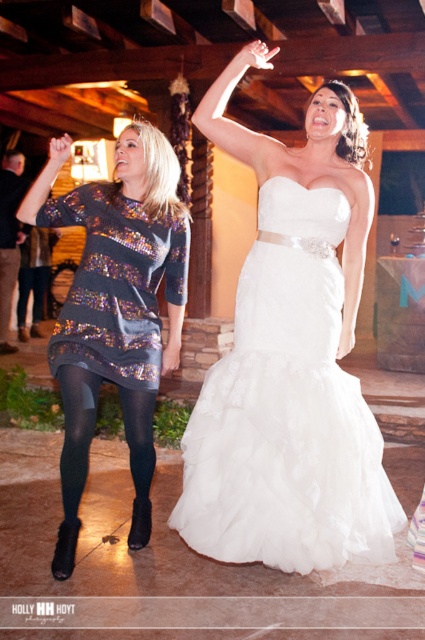
You are a photographer at the wedding reception and need to position yourself to capture the white satin dress at center. Based on the scene description, where should you aim your camera to ensure the dress is in the frame?

A: The white satin dress at center is located at point (289, 364), so you should aim your camera towards those coordinates to ensure the dress is centered in the frame.

You are a photographer at the wedding reception and need to capture a closeup shot of the white satin dress at center and the black tights at lower left. Given the camera lens you have can only focus on objects within a 1.5 meter width, will both items fit in the frame?

The white satin dress at center has a larger width than the black tights at lower left. Since the dress is wider, it might exceed the 1.5 meter width capacity of the camera lens, so both items may not fit in the frame.

Based on the photo, you are a photographer at the wedding reception and want to capture a closeup of the white satin dress at center without the sparkly sequin dress at left appearing in the background. Is this possible given their positions?

The white satin dress at center is closer to the viewer than the sparkly sequin dress at left, so by focusing on the white satin dress at center and using a shallow depth of field, the photographer can blur the background and exclude the sparkly sequin dress at left from the frame.